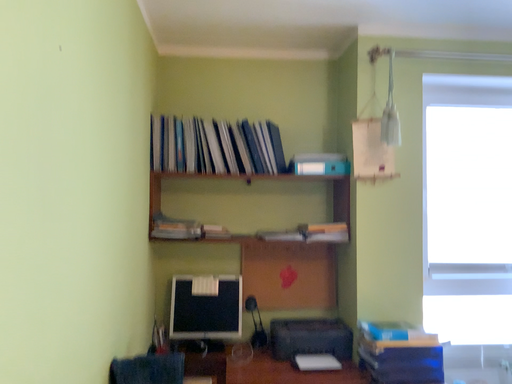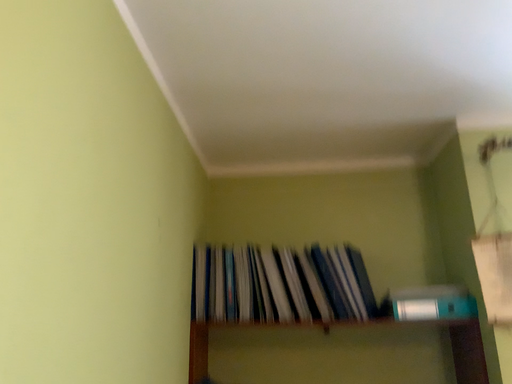
Question: How did the camera likely rotate when shooting the video?

Choices:
 (A) rotated downward
 (B) rotated upward

Answer: (B)